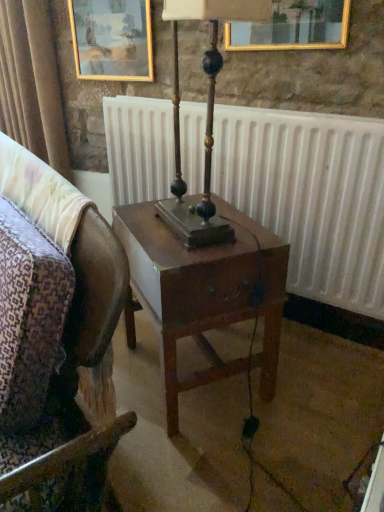
Question: Is gold-framed painting at upper left taller than wooden chair at center?

Choices:
 (A) no
 (B) yes

Answer: (A)

Question: Considering the relative positions of gold-framed painting at upper left and wooden chair at center in the image provided, is gold-framed painting at upper left to the right of wooden chair at center from the viewer's perspective?

Choices:
 (A) no
 (B) yes

Answer: (B)

Question: Is wooden chair at center at the back of gold-framed painting at upper left?

Choices:
 (A) yes
 (B) no

Answer: (B)

Question: From the image's perspective, does gold-framed painting at upper left appear higher than wooden chair at center?

Choices:
 (A) yes
 (B) no

Answer: (A)

Question: Is gold-framed painting at upper left bigger than wooden chair at center?

Choices:
 (A) yes
 (B) no

Answer: (B)

Question: Does gold-framed painting at upper left have a smaller size compared to wooden chair at center?

Choices:
 (A) no
 (B) yes

Answer: (B)

Question: From the image's perspective, is wooden polished table lamp at center over gold-framed painting at upper left?

Choices:
 (A) yes
 (B) no

Answer: (B)

Question: Is wooden polished table lamp at center oriented towards gold-framed painting at upper left?

Choices:
 (A) no
 (B) yes

Answer: (A)

Question: Is wooden polished table lamp at center not inside gold-framed painting at upper left?

Choices:
 (A) no
 (B) yes

Answer: (B)

Question: Does wooden polished table lamp at center have a larger size compared to gold-framed painting at upper left?

Choices:
 (A) no
 (B) yes

Answer: (B)

Question: Is wooden polished table lamp at center wider than gold-framed painting at upper left?

Choices:
 (A) yes
 (B) no

Answer: (A)

Question: Is gold-framed painting at upper left surrounded by wooden polished table lamp at center?

Choices:
 (A) yes
 (B) no

Answer: (B)

Question: Can you confirm if velvet curtain at upper left is thinner than wooden chair at center?

Choices:
 (A) yes
 (B) no

Answer: (A)